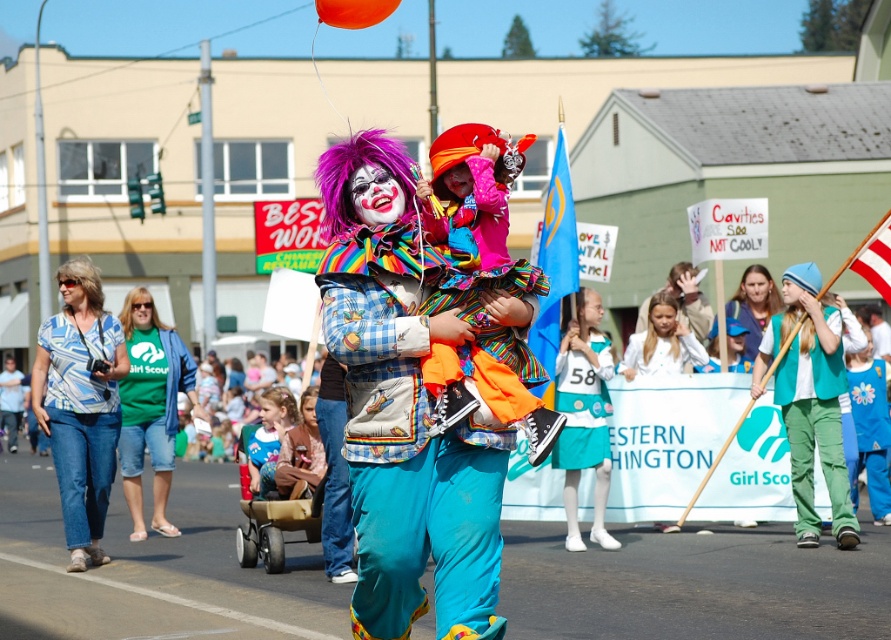
Question: Does matte blue pants at center have a lesser width compared to blue printed shirt at left?

Choices:
 (A) yes
 (B) no

Answer: (B)

Question: Can you confirm if teal satin dress at center is wider than shiny blonde wig at center?

Choices:
 (A) no
 (B) yes

Answer: (A)

Question: Which point is farther to the camera?

Choices:
 (A) (831, 442)
 (B) (9, 433)
 (C) (145, 326)
 (D) (683, 337)

Answer: (B)

Question: Which point appears farthest from the camera in this image?

Choices:
 (A) (121, 314)
 (B) (84, 328)
 (C) (582, 448)

Answer: (A)

Question: Which point is closer to the camera taking this photo?

Choices:
 (A) (10, 413)
 (B) (603, 436)

Answer: (B)

Question: Does white and red striped flag at center appear on the right side of blonde synthetic wig at upper left?

Choices:
 (A) no
 (B) yes

Answer: (B)